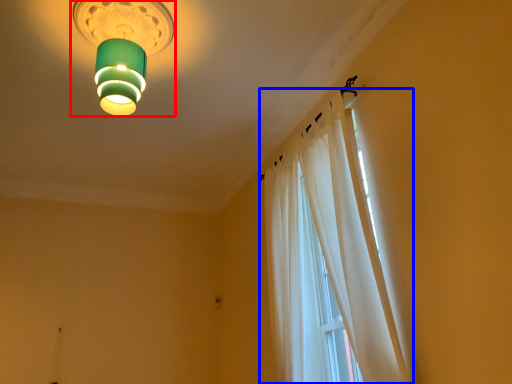
Question: Which point is further to the camera, lamp (highlighted by a red box) or curtain (highlighted by a blue box)?

Choices:
 (A) lamp
 (B) curtain

Answer: (A)